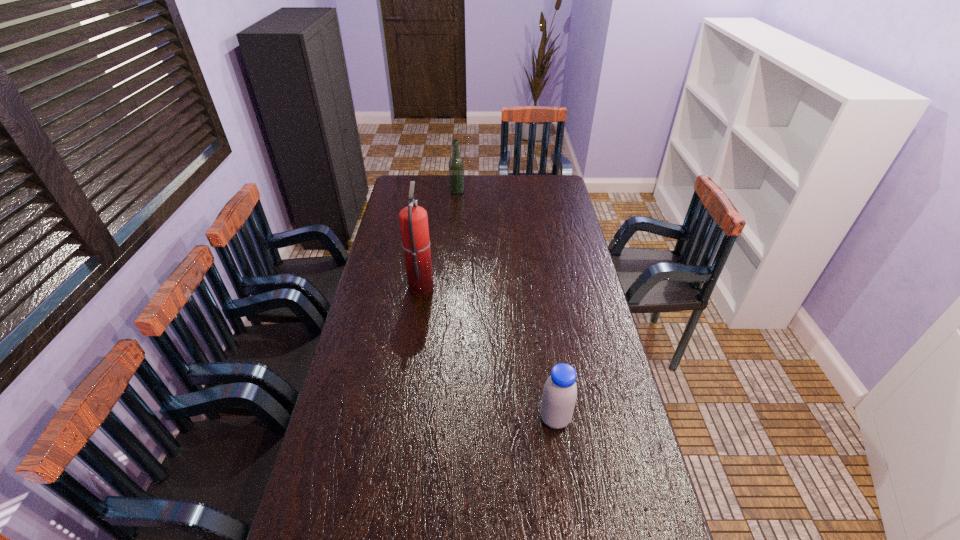
In the image, there is a desktop. At what (x,y) coordinates should I click in order to perform the action: click on vacant space at the far edge. Please return your answer as a coordinate pair (x, y). Image resolution: width=960 pixels, height=540 pixels. Looking at the image, I should click on (467, 188).

At what (x,y) coordinates should I click in order to perform the action: click on vacant area at the left edge of the desktop. Please return your answer as a coordinate pair (x, y). This screenshot has height=540, width=960. Looking at the image, I should click on (371, 346).

The image size is (960, 540). What are the coordinates of `free space at the right edge of the desktop` in the screenshot? It's located at (571, 245).

Where is `vacant point located between the farthest object and the fire extinguisher`? This screenshot has height=540, width=960. vacant point located between the farthest object and the fire extinguisher is located at coordinates (439, 238).

The image size is (960, 540). Find the location of `free spot between the shortest object and the leftmost object`. free spot between the shortest object and the leftmost object is located at coordinates (488, 352).

Where is `free spot between the liquor and the fire extinguisher`? The width and height of the screenshot is (960, 540). free spot between the liquor and the fire extinguisher is located at coordinates (439, 238).

Where is `vacant area that lies between the second object from left to right and the rightmost object`? This screenshot has width=960, height=540. vacant area that lies between the second object from left to right and the rightmost object is located at coordinates (506, 305).

The image size is (960, 540). Find the location of `vacant space that is in between the tallest object and the second tallest object`. vacant space that is in between the tallest object and the second tallest object is located at coordinates (439, 238).

You are a GUI agent. You are given a task and a screenshot of the screen. Output one action in this format:
    pyautogui.click(x=<x>, y=<y>)
    Task: Click on the vacant space in between the shortest object and the tallest object
    The image size is (960, 540).
    Given the screenshot: What is the action you would take?
    pyautogui.click(x=488, y=352)

Where is `the closest object to the shortest object`? the closest object to the shortest object is located at coordinates [413, 219].